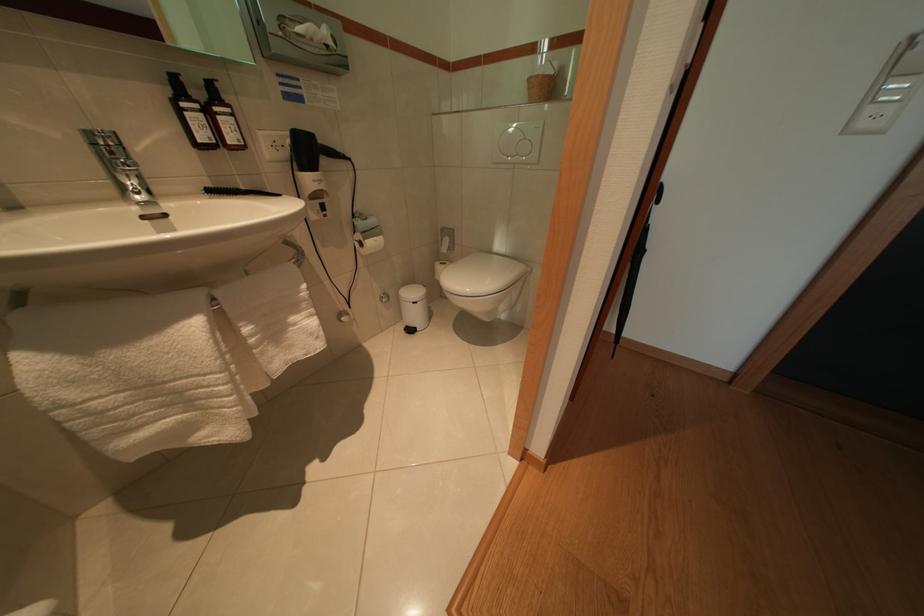
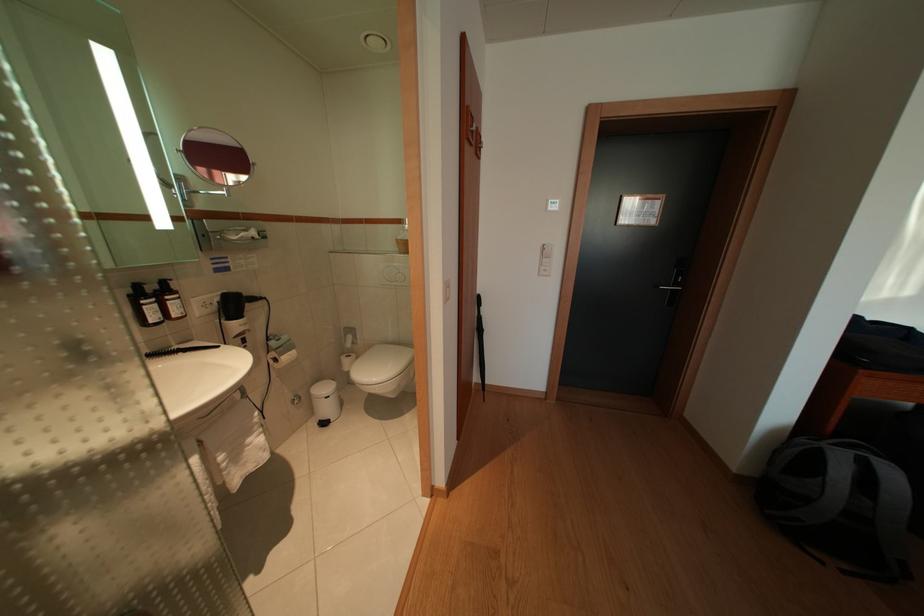
Question: I am providing you with two images of the same scene from different viewpoints. Which of the following objects are not visible in image2?

Choices:
 (A) soap dispenser pump
 (B) grey backpack
 (C) trash can pedal
 (D) none of these

Answer: (D)